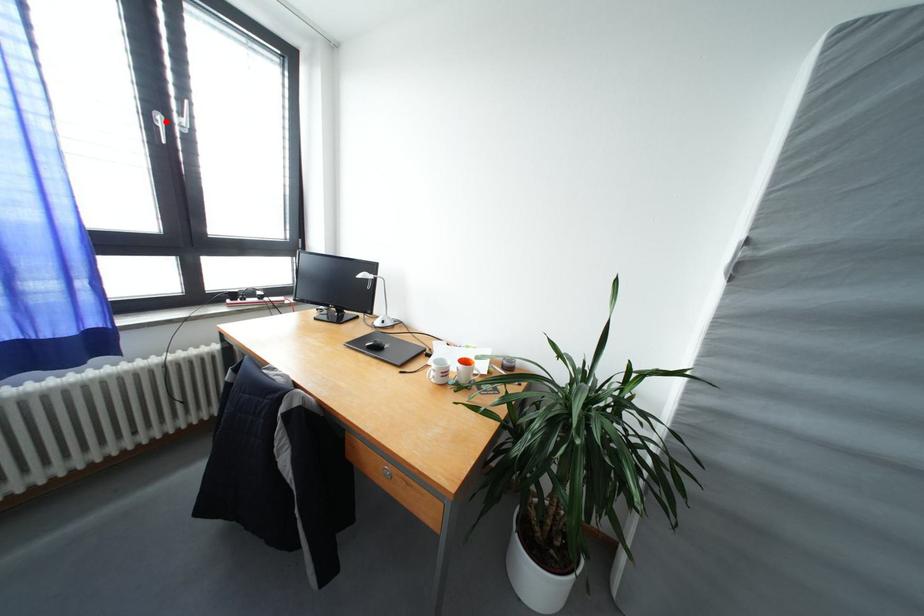
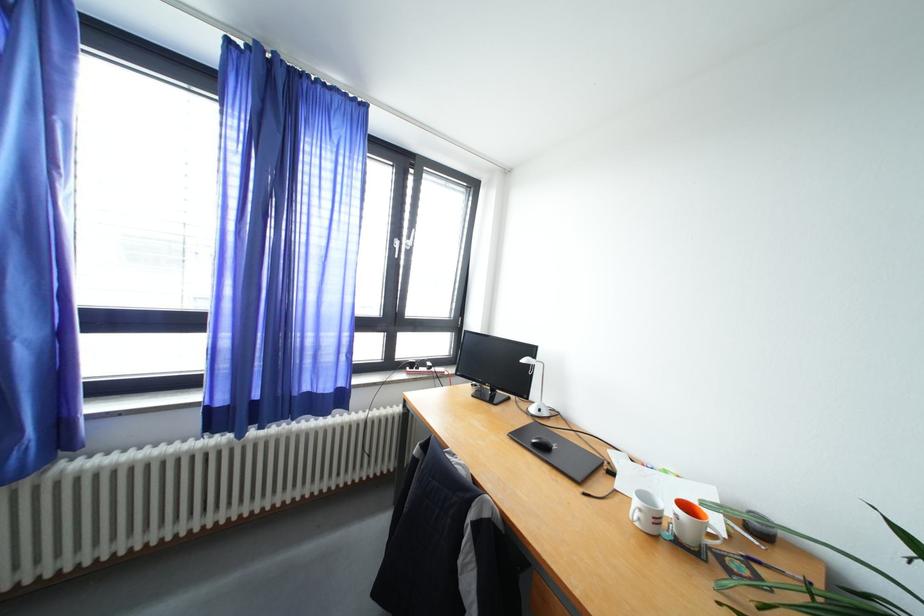
In the second image, find the point that corresponds to the highlighted location in the first image.

(404, 246)